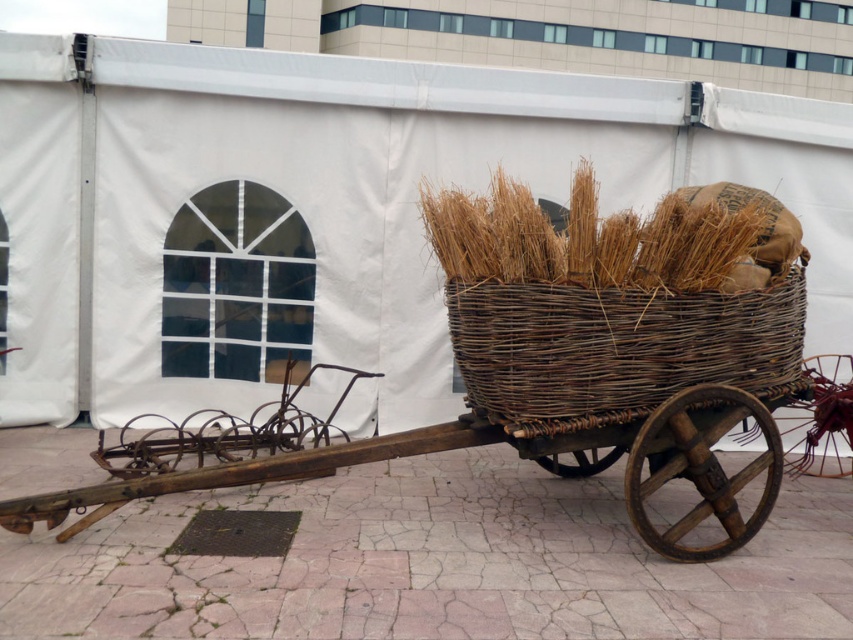
Between woven brown basket at center and woven wood cart at center, which one has more height?

Standing taller between the two is woven wood cart at center.

Does woven brown basket at center have a lesser width compared to woven wood cart at center?

Indeed, woven brown basket at center has a lesser width compared to woven wood cart at center.

Image resolution: width=853 pixels, height=640 pixels. In order to click on woven brown basket at center in this screenshot , I will do `click(616, 342)`.

Where is `woven brown basket at center`? Image resolution: width=853 pixels, height=640 pixels. woven brown basket at center is located at coordinates (616, 342).